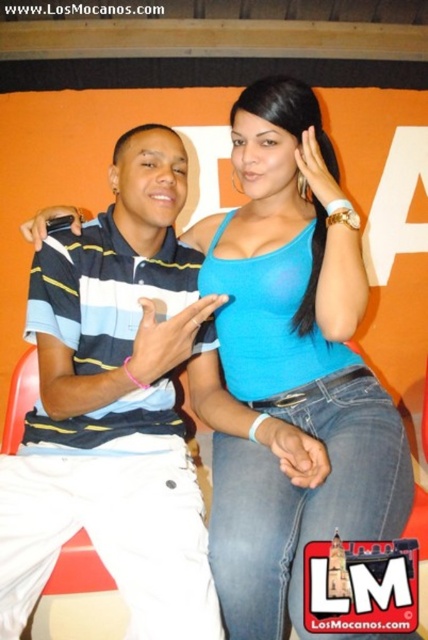
Can you confirm if striped cotton polo shirt at center is wider than blue matte tank top at center?

No.

Is striped cotton polo shirt at center further to camera compared to blue matte tank top at center?

Yes, striped cotton polo shirt at center is further from the viewer.

You are a GUI agent. You are given a task and a screenshot of the screen. Output one action in this format:
    pyautogui.click(x=<x>, y=<y>)
    Task: Click on the striped cotton polo shirt at center
    The image size is (428, 640).
    Given the screenshot: What is the action you would take?
    pyautogui.click(x=115, y=406)

You are a GUI agent. You are given a task and a screenshot of the screen. Output one action in this format:
    pyautogui.click(x=<x>, y=<y>)
    Task: Click on the striped cotton polo shirt at center
    
    Given the screenshot: What is the action you would take?
    pyautogui.click(x=115, y=406)